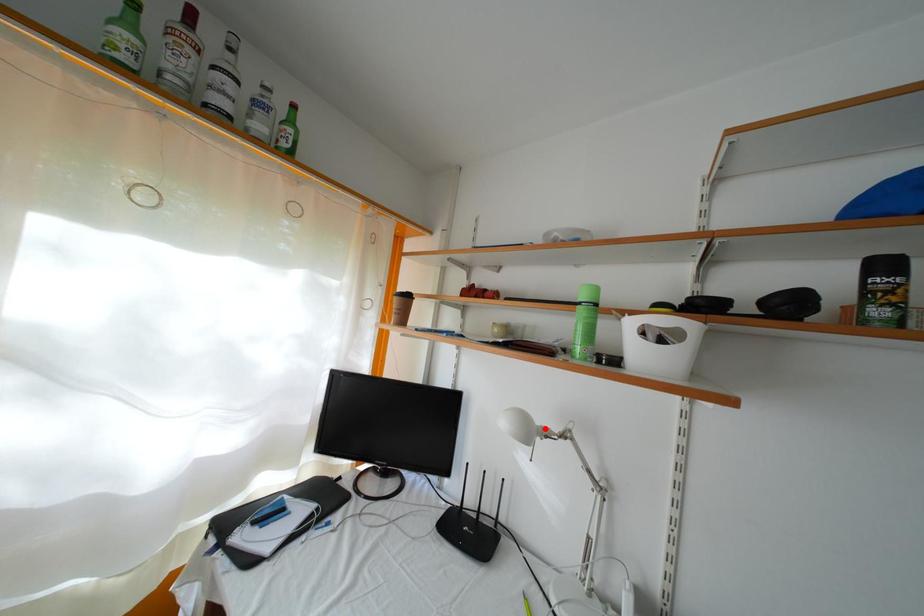
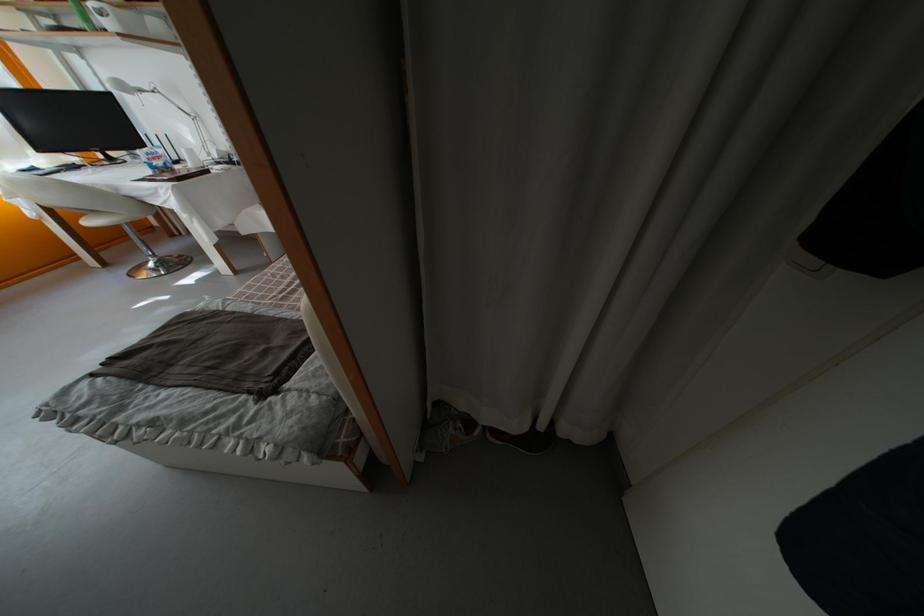
Question: A red point is marked in image1. In image2, is the corresponding 3D point closer to the camera or farther? Reply with the corresponding letter.

Choices:
 (A) The corresponding 3D point is closer.
 (B) The corresponding 3D point is farther.

Answer: (B)